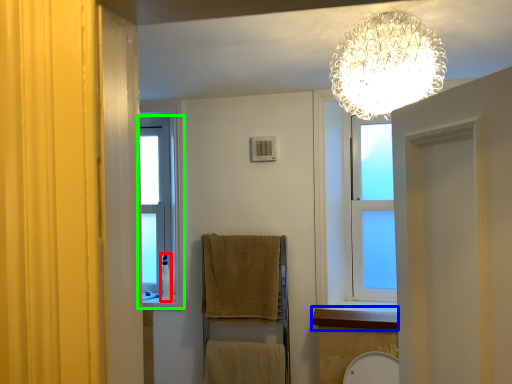
Question: Considering the real-world distances, which object is closest to toiletry (highlighted by a red box)? window sill (highlighted by a blue box) or window (highlighted by a green box).

Choices:
 (A) window sill
 (B) window

Answer: (B)